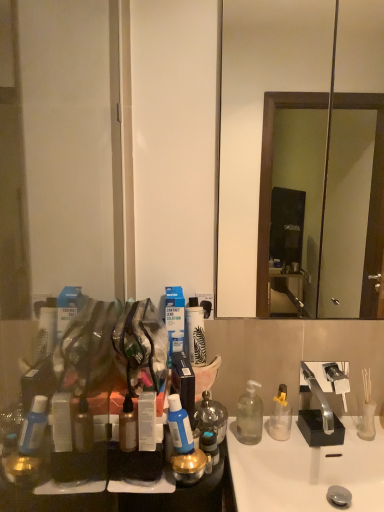
Question: Which direction should I rotate to look at clear plastic bottle at center, which ranks as the fourth bottle in front-to-back order, — up or down?

Choices:
 (A) down
 (B) up

Answer: (A)

Question: Can you confirm if blue translucent bottle at center, which is counted as the 3th bottle, starting from the right, is shorter than metallic silver spray can at lower left, the first bottle in the front-to-back sequence?

Choices:
 (A) yes
 (B) no

Answer: (B)

Question: From a real-world perspective, is blue translucent bottle at center, which is counted as the 3th bottle, starting from the right, positioned over metallic silver spray can at lower left, the 4th bottle in the right-to-left sequence, based on gravity?

Choices:
 (A) no
 (B) yes

Answer: (B)

Question: Is blue translucent bottle at center, which is the 2th bottle in front-to-back order, taller than metallic silver spray can at lower left, the first bottle in the front-to-back sequence?

Choices:
 (A) no
 (B) yes

Answer: (B)

Question: From the image's perspective, is blue translucent bottle at center, positioned as the second bottle in left-to-right order, above metallic silver spray can at lower left, the 4th bottle in the right-to-left sequence?

Choices:
 (A) no
 (B) yes

Answer: (B)

Question: Is blue translucent bottle at center, which is the 2th bottle in front-to-back order, not near metallic silver spray can at lower left, the first bottle in the front-to-back sequence?

Choices:
 (A) yes
 (B) no

Answer: (B)

Question: From a real-world perspective, is blue translucent bottle at center, the 3th bottle in the back-to-front sequence, below metallic silver spray can at lower left, the first bottle in the front-to-back sequence?

Choices:
 (A) yes
 (B) no

Answer: (B)

Question: Is clear plastic bottle at center, which ranks as the fourth bottle in front-to-back order, smaller than blue translucent bottle at center, which is counted as the 3th bottle, starting from the right?

Choices:
 (A) yes
 (B) no

Answer: (B)

Question: Is clear plastic bottle at center, placed as the 4th bottle when sorted from left to right, closer to camera compared to blue translucent bottle at center, which is counted as the 3th bottle, starting from the right?

Choices:
 (A) no
 (B) yes

Answer: (A)

Question: Does clear plastic bottle at center, the first bottle when ordered from back to front, have a lesser height compared to blue translucent bottle at center, the 3th bottle in the back-to-front sequence?

Choices:
 (A) no
 (B) yes

Answer: (A)

Question: Is clear plastic bottle at center, the first bottle when ordered from back to front, with blue translucent bottle at center, which is counted as the 3th bottle, starting from the right?

Choices:
 (A) yes
 (B) no

Answer: (B)

Question: From a real-world perspective, is clear plastic bottle at center, which ranks as the fourth bottle in front-to-back order, positioned over blue translucent bottle at center, positioned as the second bottle in left-to-right order, based on gravity?

Choices:
 (A) no
 (B) yes

Answer: (A)

Question: Is clear plastic bottle at center, which ranks as the fourth bottle in front-to-back order, wider than blue translucent bottle at center, which is counted as the 3th bottle, starting from the right?

Choices:
 (A) yes
 (B) no

Answer: (A)

Question: Considering the relative sizes of blue translucent bottle at center, which is counted as the 3th bottle, starting from the right, and clear plastic bottle at center, the first bottle when ordered from back to front, in the image provided, is blue translucent bottle at center, which is counted as the 3th bottle, starting from the right, wider than clear plastic bottle at center, the first bottle when ordered from back to front,?

Choices:
 (A) no
 (B) yes

Answer: (A)